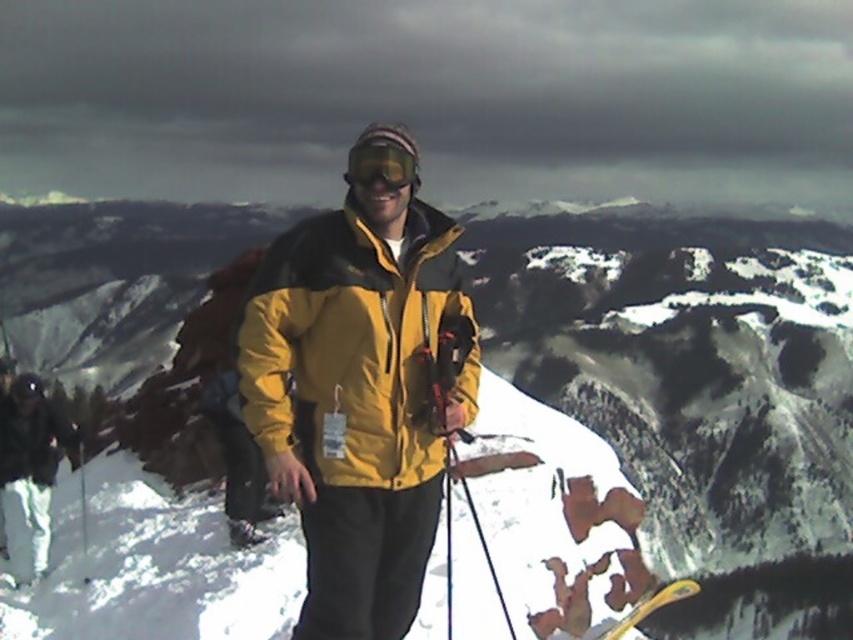
You are a photographer trying to capture the subject wearing the yellow matte jacket at center and green matte goggles at center. Which item is positioned lower on the person?

The yellow matte jacket at center is positioned lower than the green matte goggles at center on the person.

You are planning to take a photo of the yellow matte jacket at center and the yellow plastic ski at center. Which object should you focus on first if you want to capture both in the same frame without moving the camera?

The yellow matte jacket at center is not as tall as the yellow plastic ski at center, so you should focus on the yellow plastic ski at center first to ensure it fits within the frame.